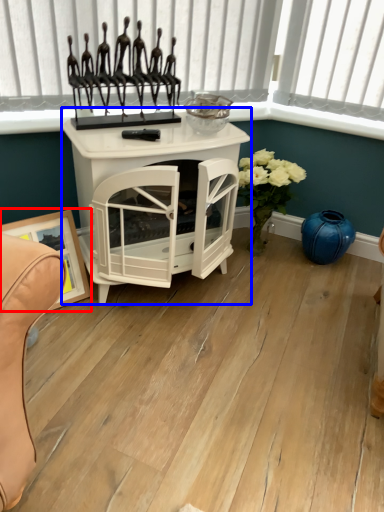
Question: Which object is closer to the camera taking this photo, picture frame (highlighted by a red box) or table (highlighted by a blue box)?

Choices:
 (A) picture frame
 (B) table

Answer: (B)